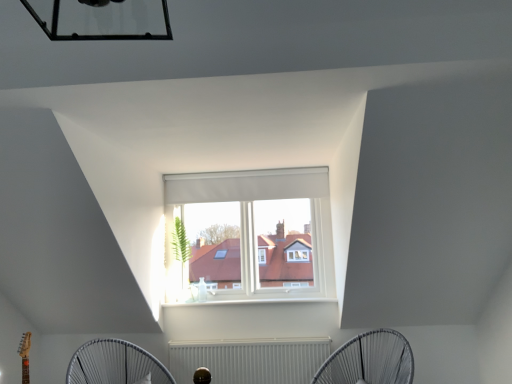
This screenshot has height=384, width=512. Describe the element at coordinates (250, 359) in the screenshot. I see `white textured radiator at lower center` at that location.

The image size is (512, 384). In order to click on white fabric mechanical fan at lower center, the first mechanical fan from the right in this screenshot , I will do [x=369, y=360].

Is white wireframe fan at lower center, the second mechanical fan from the right, thinner than white fabric mechanical fan at lower center, the first mechanical fan from the right?

Yes, white wireframe fan at lower center, the second mechanical fan from the right, is thinner than white fabric mechanical fan at lower center, the first mechanical fan from the right.

Is white wireframe fan at lower center, marked as the 1th mechanical fan in a left-to-right arrangement, behind white fabric mechanical fan at lower center, the second mechanical fan when ordered from left to right?

Yes, it is.

Is white wireframe fan at lower center, the second mechanical fan from the right, oriented away from white fabric mechanical fan at lower center, the first mechanical fan from the right?

No, white wireframe fan at lower center, the second mechanical fan from the right, is not facing the opposite direction of white fabric mechanical fan at lower center, the first mechanical fan from the right.

Identify the location of mechanical fan that is behind the white fabric mechanical fan at lower center, the first mechanical fan from the right. (115, 364).

Considering the relative sizes of white textured radiator at lower center and white wireframe fan at lower center, marked as the 1th mechanical fan in a left-to-right arrangement, in the image provided, is white textured radiator at lower center wider than white wireframe fan at lower center, marked as the 1th mechanical fan in a left-to-right arrangement,?

In fact, white textured radiator at lower center might be narrower than white wireframe fan at lower center, marked as the 1th mechanical fan in a left-to-right arrangement.

Is white textured radiator at lower center at the right side of white wireframe fan at lower center, marked as the 1th mechanical fan in a left-to-right arrangement?

Indeed, white textured radiator at lower center is positioned on the right side of white wireframe fan at lower center, marked as the 1th mechanical fan in a left-to-right arrangement.

Which is closer to the camera, (x=240, y=374) or (x=104, y=367)?

Point (x=240, y=374).

From a real-world perspective, which object rests below the other?

In real-world perspective, white textured radiator at lower center is lower.

Does point (140, 354) come closer to viewer compared to point (243, 346)?

That is True.

From a real-world perspective, who is located lower, white wireframe fan at lower center, marked as the 1th mechanical fan in a left-to-right arrangement, or white textured radiator at lower center?

In real-world perspective, white textured radiator at lower center is lower.

In the scene shown: Is the surface of white wireframe fan at lower center, marked as the 1th mechanical fan in a left-to-right arrangement, in direct contact with white textured radiator at lower center?

white wireframe fan at lower center, marked as the 1th mechanical fan in a left-to-right arrangement, is not next to white textured radiator at lower center, and they're not touching.

Considering the points (404, 376) and (229, 383), which point is in front, point (404, 376) or point (229, 383)?

The point (404, 376) is in front.

Is white fabric mechanical fan at lower center, the first mechanical fan from the right, far away from white textured radiator at lower center?

They are positioned close to each other.

Measure the distance between white fabric mechanical fan at lower center, the second mechanical fan when ordered from left to right, and white textured radiator at lower center.

A distance of 25.07 inches exists between white fabric mechanical fan at lower center, the second mechanical fan when ordered from left to right, and white textured radiator at lower center.

Is white fabric mechanical fan at lower center, the first mechanical fan from the right, shorter than white wireframe fan at lower center, the second mechanical fan from the right?

No.

Looking at this image, considering the sizes of objects white fabric mechanical fan at lower center, the first mechanical fan from the right, and white wireframe fan at lower center, marked as the 1th mechanical fan in a left-to-right arrangement, in the image provided, who is bigger, white fabric mechanical fan at lower center, the first mechanical fan from the right, or white wireframe fan at lower center, marked as the 1th mechanical fan in a left-to-right arrangement,?

Bigger between the two is white fabric mechanical fan at lower center, the first mechanical fan from the right.

Is white fabric mechanical fan at lower center, the second mechanical fan when ordered from left to right, wider than white wireframe fan at lower center, the second mechanical fan from the right?

Yes, white fabric mechanical fan at lower center, the second mechanical fan when ordered from left to right, is wider than white wireframe fan at lower center, the second mechanical fan from the right.

In the image, is white textured radiator at lower center positioned in front of or behind white fabric mechanical fan at lower center, the second mechanical fan when ordered from left to right?

white textured radiator at lower center is behind white fabric mechanical fan at lower center, the second mechanical fan when ordered from left to right.

How much distance is there between white textured radiator at lower center and white fabric mechanical fan at lower center, the first mechanical fan from the right?

white textured radiator at lower center is 25.07 inches from white fabric mechanical fan at lower center, the first mechanical fan from the right.

From a real-world perspective, which is physically above, white textured radiator at lower center or white fabric mechanical fan at lower center, the first mechanical fan from the right?

white fabric mechanical fan at lower center, the first mechanical fan from the right, is physically above.

Does white textured radiator at lower center contain white fabric mechanical fan at lower center, the first mechanical fan from the right?

Definitely not — white fabric mechanical fan at lower center, the first mechanical fan from the right, is not inside white textured radiator at lower center.

This screenshot has height=384, width=512. I want to click on mechanical fan on the right of white wireframe fan at lower center, marked as the 1th mechanical fan in a left-to-right arrangement, so click(369, 360).

The width and height of the screenshot is (512, 384). I want to click on mechanical fan that is the 1st one when counting upward from the white textured radiator at lower center (from the image's perspective), so click(115, 364).

Considering their positions, is white wireframe fan at lower center, the second mechanical fan from the right, positioned closer to white textured radiator at lower center than white fabric mechanical fan at lower center, the first mechanical fan from the right?

Among the two, white fabric mechanical fan at lower center, the first mechanical fan from the right, is located nearer to white textured radiator at lower center.

Considering their positions, is white textured radiator at lower center positioned further to white wireframe fan at lower center, marked as the 1th mechanical fan in a left-to-right arrangement, than white fabric mechanical fan at lower center, the first mechanical fan from the right?

The object further to white wireframe fan at lower center, marked as the 1th mechanical fan in a left-to-right arrangement, is white fabric mechanical fan at lower center, the first mechanical fan from the right.

Which object lies nearer to the anchor point white wireframe fan at lower center, marked as the 1th mechanical fan in a left-to-right arrangement, white fabric mechanical fan at lower center, the second mechanical fan when ordered from left to right, or white textured radiator at lower center?

The object closer to white wireframe fan at lower center, marked as the 1th mechanical fan in a left-to-right arrangement, is white textured radiator at lower center.

Estimate the real-world distances between objects in this image. Which object is closer to white fabric mechanical fan at lower center, the first mechanical fan from the right, white textured radiator at lower center or white wireframe fan at lower center, the second mechanical fan from the right?

white textured radiator at lower center is closer to white fabric mechanical fan at lower center, the first mechanical fan from the right.

Based on their spatial positions, is white fabric mechanical fan at lower center, the first mechanical fan from the right, or white wireframe fan at lower center, the second mechanical fan from the right, further from white textured radiator at lower center?

white wireframe fan at lower center, the second mechanical fan from the right, lies further to white textured radiator at lower center than the other object.

Looking at the image, which one is located further to white fabric mechanical fan at lower center, the second mechanical fan when ordered from left to right, white wireframe fan at lower center, marked as the 1th mechanical fan in a left-to-right arrangement, or white textured radiator at lower center?

white wireframe fan at lower center, marked as the 1th mechanical fan in a left-to-right arrangement.

I want to click on radiator located between white wireframe fan at lower center, marked as the 1th mechanical fan in a left-to-right arrangement, and white fabric mechanical fan at lower center, the first mechanical fan from the right, in the left-right direction, so click(x=250, y=359).